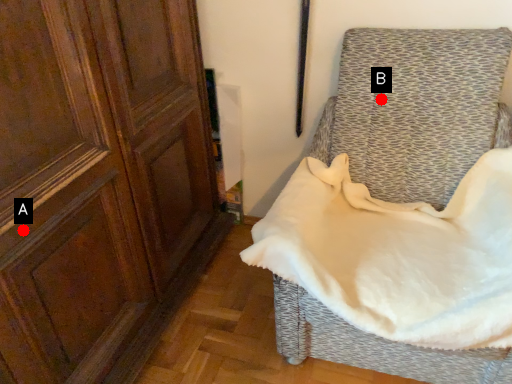
Question: Two points are circled on the image, labeled by A and B beside each circle. Which point is closer to the camera taking this photo?

Choices:
 (A) A is closer
 (B) B is closer

Answer: (A)